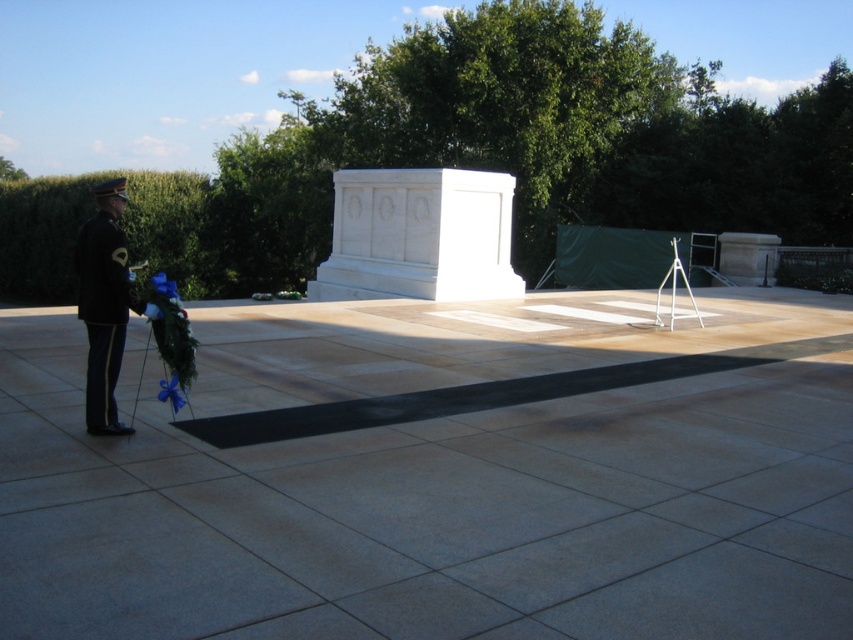
Who is shorter, black uniform at left or blue satin ribbon at lower left?

blue satin ribbon at lower left

Does black uniform at left appear on the left side of blue satin ribbon at lower left?

Yes, black uniform at left is to the left of blue satin ribbon at lower left.

Is point (97, 372) closer to viewer compared to point (173, 387)?

Yes.

In order to click on black uniform at left in this screenshot , I will do `click(105, 305)`.